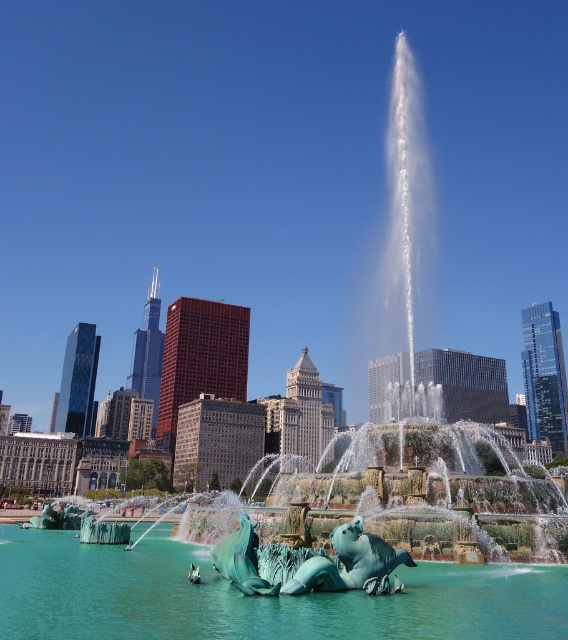
You are standing at the point with coordinates (304, 561) in the urban scene. What object is exactly at your current location?

The green marble sculpture at center is located at point (304, 561).